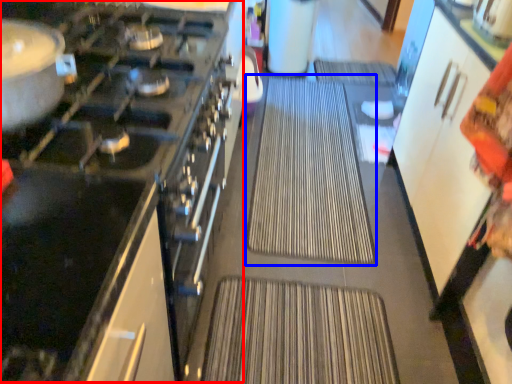
Question: Which point is further to the camera, appliance (highlighted by a red box) or wide (highlighted by a blue box)?

Choices:
 (A) appliance
 (B) wide

Answer: (B)